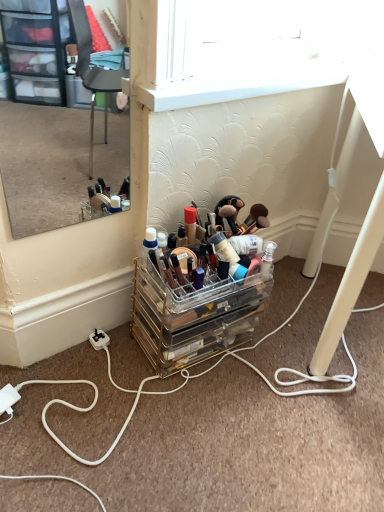
Question: From their relative heights in the image, would you say white cord at lower left is taller or shorter than clear acrylic makeup organizer at center?

Choices:
 (A) short
 (B) tall

Answer: (A)

Question: Considering the positions of white cord at lower left and clear acrylic makeup organizer at center in the image, is white cord at lower left wider or thinner than clear acrylic makeup organizer at center?

Choices:
 (A) wide
 (B) thin

Answer: (A)

Question: Based on their relative distances, which object is nearer to the clear acrylic makeup organizer at lower center?

Choices:
 (A) white plastic power outlet at lower left
 (B) clear acrylic makeup organizer at center
 (C) white cord at lower left
 (D) clear glass mirror at upper left

Answer: (B)

Question: Which object is the closest to the white cord at lower left?

Choices:
 (A) clear glass mirror at upper left
 (B) white plastic power outlet at lower left
 (C) clear acrylic makeup organizer at lower center
 (D) clear acrylic makeup organizer at center

Answer: (D)